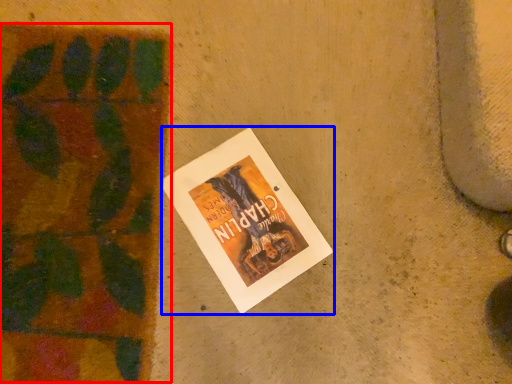
Question: Which of the following is the closest to the observer, plant (highlighted by a red box) or book (highlighted by a blue box)?

Choices:
 (A) plant
 (B) book

Answer: (A)